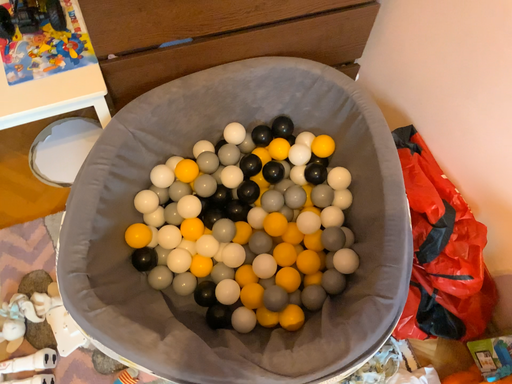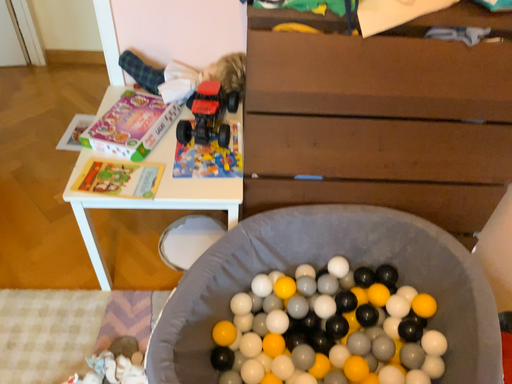
Question: Which way did the camera rotate in the video?

Choices:
 (A) rotated downward
 (B) rotated upward

Answer: (B)